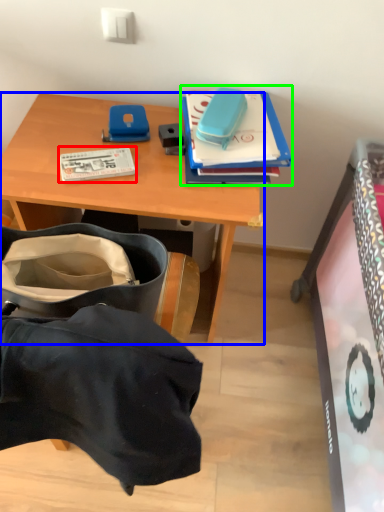
Question: Which object is the farthest from book (highlighted by a red box)? Choose among these: desk (highlighted by a blue box) or book (highlighted by a green box).

Choices:
 (A) desk
 (B) book

Answer: (B)